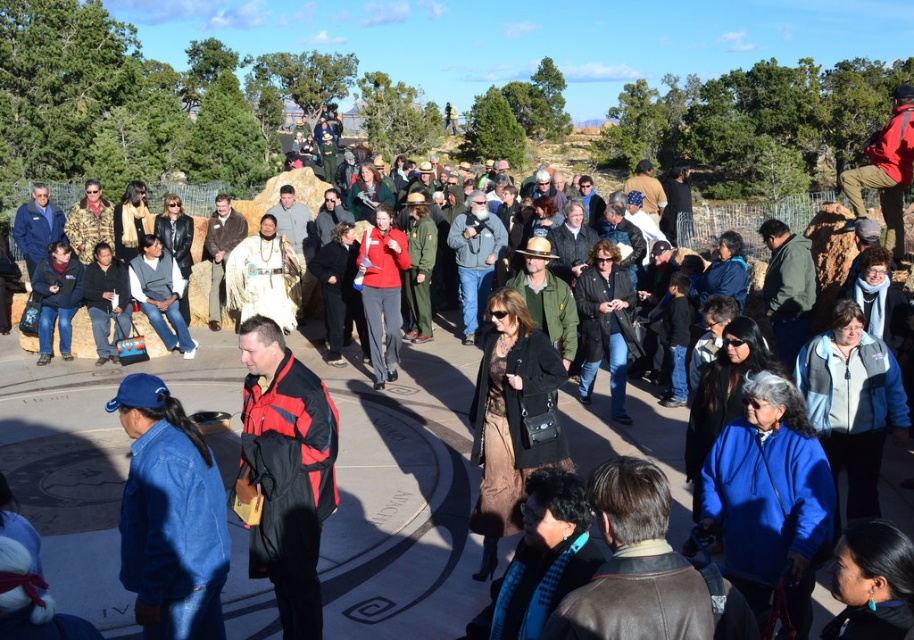
Question: Does denim jacket at lower left lie behind matte red jacket at center?

Choices:
 (A) no
 (B) yes

Answer: (A)

Question: Which point appears closest to the camera in this image?

Choices:
 (A) (273, 444)
 (B) (147, 388)
 (C) (367, 243)

Answer: (B)

Question: Is red/black jacket at center wider than matte red jacket at center?

Choices:
 (A) yes
 (B) no

Answer: (B)

Question: Does denim jacket at lower left come in front of red/black jacket at center?

Choices:
 (A) yes
 (B) no

Answer: (A)

Question: Estimate the real-world distances between objects in this image. Which object is farther from the denim jacket at lower left?

Choices:
 (A) red/black jacket at center
 (B) matte red jacket at center

Answer: (B)

Question: Which object is farther from the camera taking this photo?

Choices:
 (A) matte red jacket at center
 (B) denim jacket at lower left

Answer: (A)